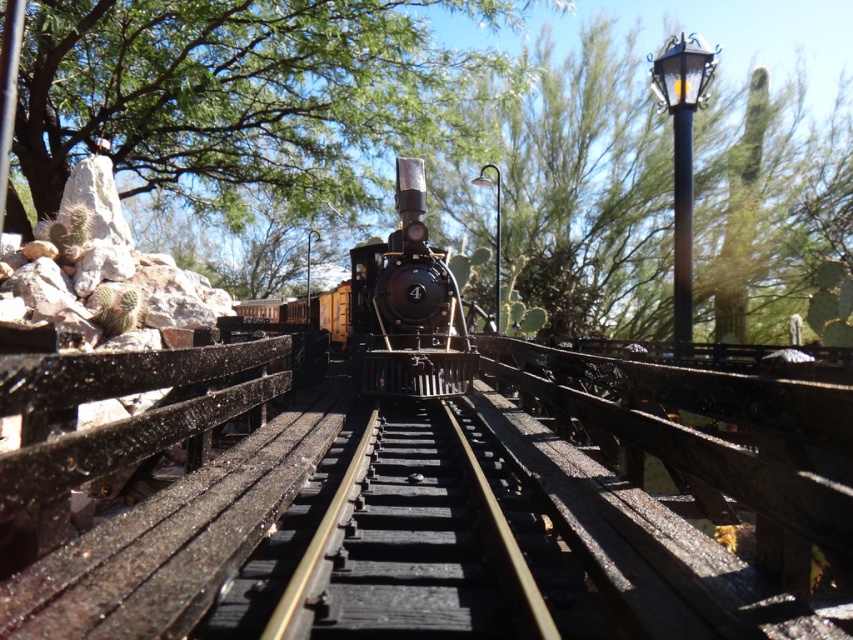
You are a bird flying above the desert scene. You want to land on the shiny black locomotive at center but need to avoid the green leafy tree at upper center. Given that your wingspan is 1.5 meters, can you safely navigate between them without hitting the tree?

The distance between the green leafy tree at upper center and the shiny black locomotive at center is 6.86 meters. Since your wingspan is only 1.5 meters, there is sufficient space to navigate between them safely without hitting the tree.

You are a bird flying over the desert scene. You see the green leafy tree at upper center and the black metal train track at center. Which object is taller?

The green leafy tree at upper center is taller than the black metal train track at center.

Based on the photo, you are standing on the railway tracks and see the green leafy tree at upper center and the shiny black locomotive at center. Which object is nearer to you?

The green leafy tree at upper center is closer to the viewer than the shiny black locomotive at center.